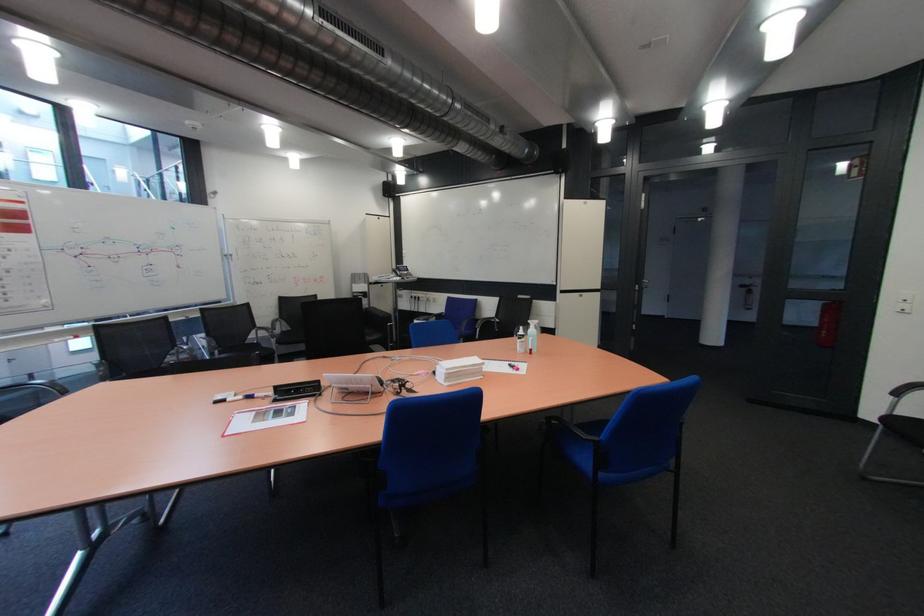
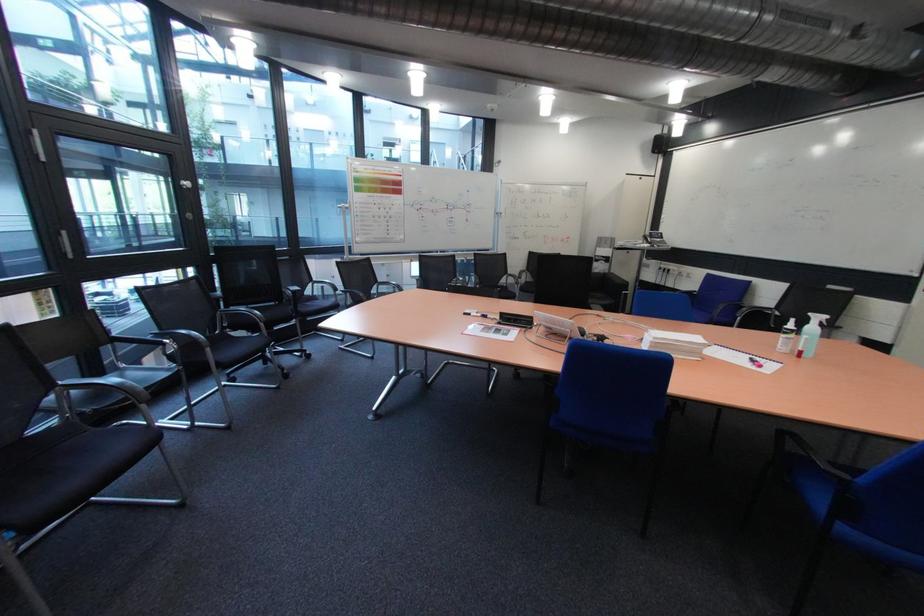
Question: The first image is from the beginning of the video and the second image is from the end. How did the camera likely rotate when shooting the video?

Choices:
 (A) Left
 (B) Right
 (C) Up
 (D) Down

Answer: (A)